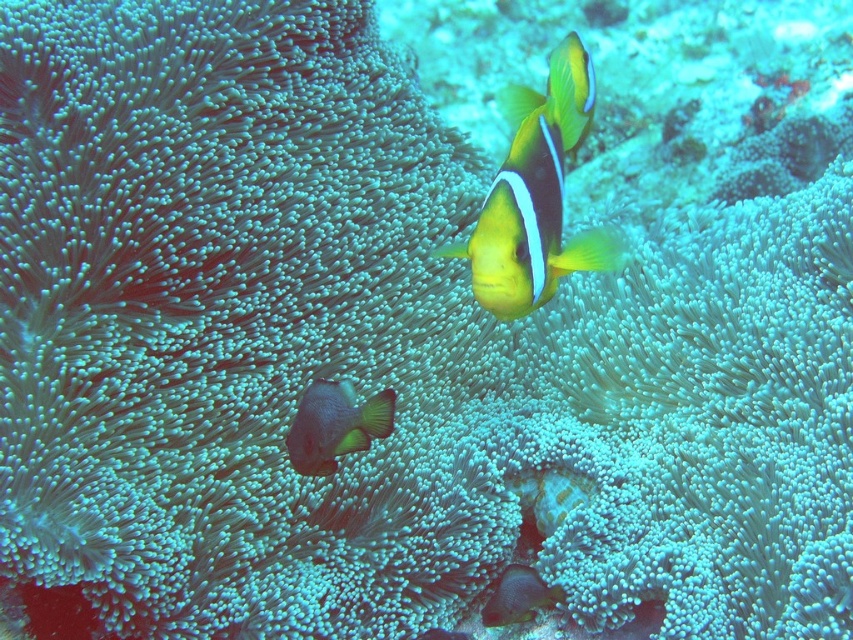
Question: Which point is closer to the camera taking this photo?

Choices:
 (A) [x=347, y=397]
 (B) [x=573, y=125]

Answer: (B)

Question: Where is yellow matte clownfish at center located in relation to matte gray fish at center in the image?

Choices:
 (A) left
 (B) right

Answer: (B)

Question: Is yellow matte clownfish at center above matte gray fish at center?

Choices:
 (A) yes
 (B) no

Answer: (A)

Question: Which of the following is the farthest from the observer?

Choices:
 (A) (566, 83)
 (B) (322, 435)

Answer: (B)

Question: Is yellow matte clownfish at center further to the viewer compared to matte gray fish at center?

Choices:
 (A) yes
 (B) no

Answer: (B)

Question: Which point is closer to the camera taking this photo?

Choices:
 (A) (550, 289)
 (B) (340, 410)

Answer: (A)